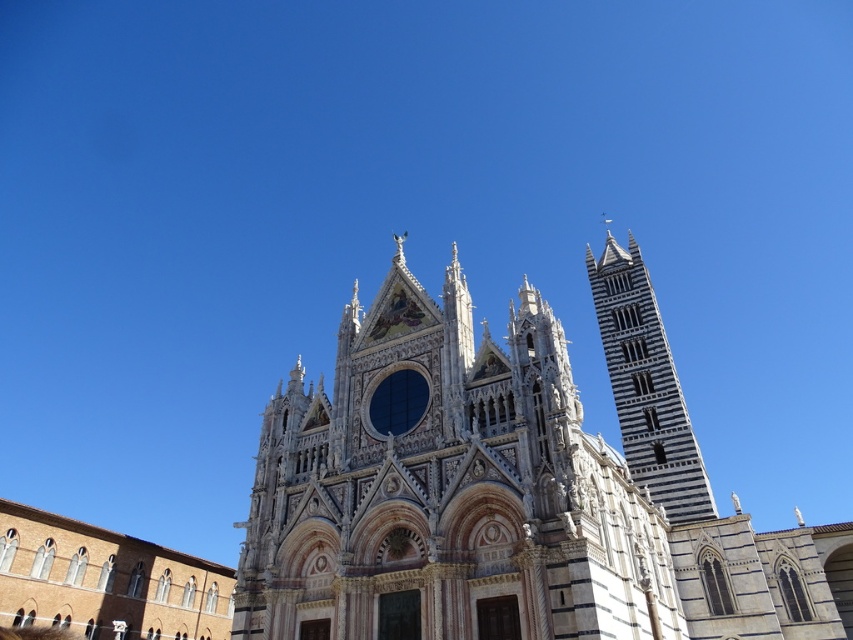
You are a tourist standing in front of the cathedral and want to take a photo that includes both the white stone church at center and the white marble tower at right. Which one should you focus on first to ensure both are in the frame?

The white stone church at center is much taller than the white marble tower at right, so you should focus on the white stone church at center first to ensure both are in the frame.

You are standing in front of the cathedral and want to determine which of the two points, point (537, 346) or point (624, 317), is closer to you. Based on the scene description, which point is nearer?

Point (537, 346) is closer to the viewer than point (624, 317).

You are an architect visiting the cathedral and need to compare the sizes of the two structures. Based on the image, which one is bigger between the white stone church at center and the white marble tower at right?

The white stone church at center is larger in size than the white marble tower at right, so the white stone church at center is bigger.